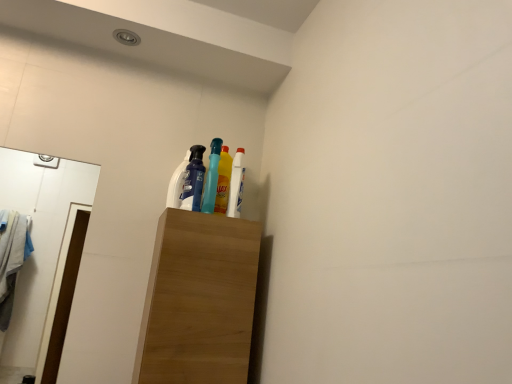
Question: Could you tell me if white glossy mirror at left is turned towards yellow glossy bottle at upper center, positioned as the 2th bottle in left-to-right order?

Choices:
 (A) yes
 (B) no

Answer: (B)

Question: From a real-world perspective, is white glossy mirror at left on yellow glossy bottle at upper center, positioned as the 2th bottle in left-to-right order?

Choices:
 (A) no
 (B) yes

Answer: (A)

Question: Is white glossy mirror at left touching yellow glossy bottle at upper center, positioned as the 2th bottle in left-to-right order?

Choices:
 (A) yes
 (B) no

Answer: (B)

Question: Is white glossy mirror at left far away from yellow glossy bottle at upper center, which is the first bottle in right-to-left order?

Choices:
 (A) yes
 (B) no

Answer: (A)

Question: Is the depth of white glossy mirror at left greater than that of yellow glossy bottle at upper center, which is the first bottle in right-to-left order?

Choices:
 (A) no
 (B) yes

Answer: (A)

Question: Does white glossy mirror at left have a larger size compared to yellow glossy bottle at upper center, positioned as the 2th bottle in left-to-right order?

Choices:
 (A) no
 (B) yes

Answer: (B)

Question: Can wooden cabinet at center be found inside translucent blue bottle at center, which is counted as the second bottle, starting from the right?

Choices:
 (A) yes
 (B) no

Answer: (B)

Question: Are translucent blue bottle at center, which is counted as the second bottle, starting from the right, and wooden cabinet at center making contact?

Choices:
 (A) no
 (B) yes

Answer: (A)

Question: Can you confirm if translucent blue bottle at center, placed as the first bottle when sorted from left to right, is smaller than wooden cabinet at center?

Choices:
 (A) no
 (B) yes

Answer: (B)

Question: Is the position of translucent blue bottle at center, which is counted as the second bottle, starting from the right, less distant than that of wooden cabinet at center?

Choices:
 (A) yes
 (B) no

Answer: (B)

Question: Considering the relative positions of translucent blue bottle at center, which is counted as the second bottle, starting from the right, and wooden cabinet at center in the image provided, is translucent blue bottle at center, which is counted as the second bottle, starting from the right, to the left of wooden cabinet at center from the viewer's perspective?

Choices:
 (A) yes
 (B) no

Answer: (B)

Question: Is translucent blue bottle at center, placed as the first bottle when sorted from left to right, to the right of wooden cabinet at center from the viewer's perspective?

Choices:
 (A) no
 (B) yes

Answer: (B)

Question: From the image's perspective, is white glossy mirror at left beneath wooden cabinet at center?

Choices:
 (A) yes
 (B) no

Answer: (B)